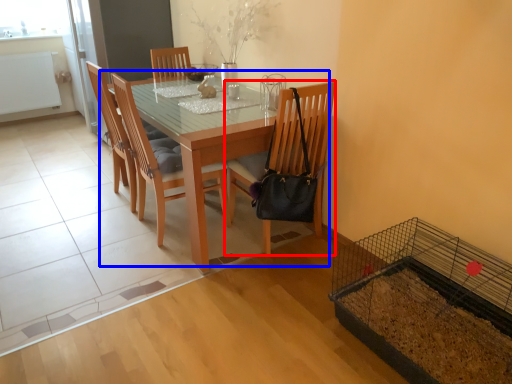
Question: Which of the following is the closest to the observer, chair (highlighted by a red box) or kitchen & dining room table (highlighted by a blue box)?

Choices:
 (A) chair
 (B) kitchen & dining room table

Answer: (B)